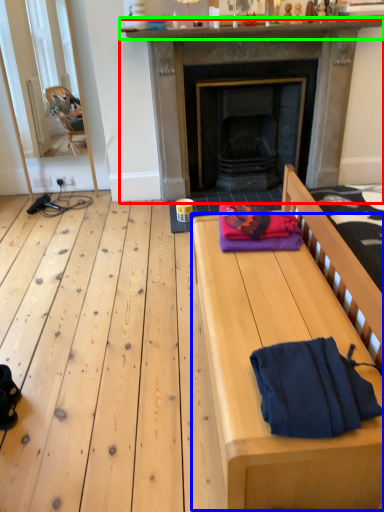
Question: Which object is positioned closest to fireplace (highlighted by a red box)? Select from table (highlighted by a blue box) and mantle (highlighted by a green box).

Choices:
 (A) table
 (B) mantle

Answer: (B)